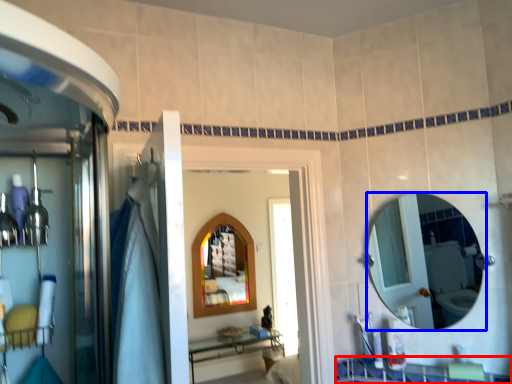
Question: Among these objects, which one is nearest to the camera, counter top (highlighted by a red box) or mirror (highlighted by a blue box)?

Choices:
 (A) counter top
 (B) mirror

Answer: (A)